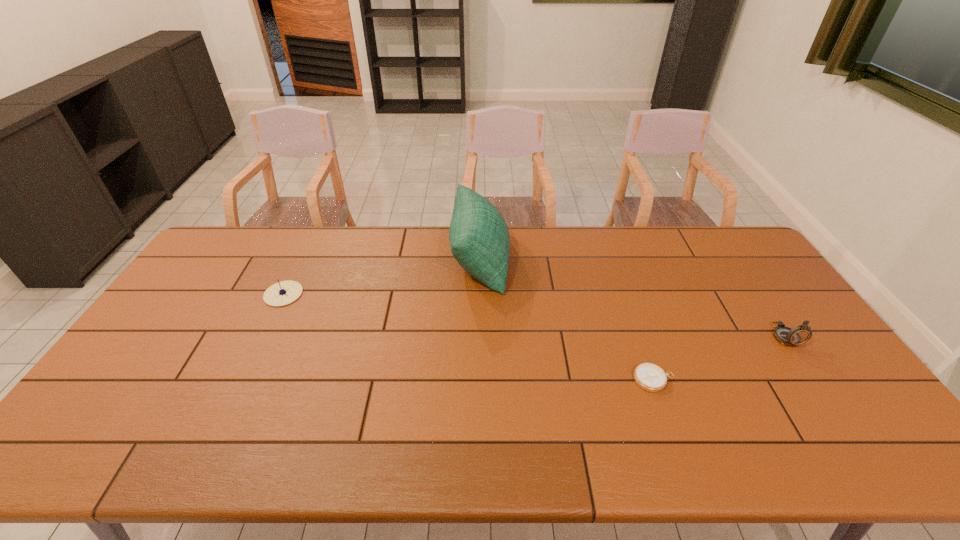
The image size is (960, 540). Find the location of `empty space between the farthest compass and the rightmost object`. empty space between the farthest compass and the rightmost object is located at coordinates (534, 315).

The height and width of the screenshot is (540, 960). I want to click on vacant region between the shortest object and the cushion, so click(567, 320).

Locate an element on the screen. The width and height of the screenshot is (960, 540). unoccupied area between the cushion and the second shortest compass is located at coordinates (382, 278).

The width and height of the screenshot is (960, 540). In order to click on free spot between the nearest object and the second nearest object in this screenshot , I will do `click(719, 357)`.

Image resolution: width=960 pixels, height=540 pixels. What are the coordinates of `vacant space in between the second object from left to right and the second compass from left to right` in the screenshot? It's located at (567, 320).

At what (x,y) coordinates should I click in order to perform the action: click on vacant space that is in between the second compass from left to right and the second tallest object. Please return your answer as a coordinate pair (x, y). This screenshot has width=960, height=540. Looking at the image, I should click on (719, 357).

Locate an element on the screen. The image size is (960, 540). vacant area that lies between the cushion and the rightmost compass is located at coordinates tap(632, 298).

The width and height of the screenshot is (960, 540). Identify the location of free space that is in between the second object from left to right and the leftmost object. (382, 278).

Locate an element on the screen. Image resolution: width=960 pixels, height=540 pixels. empty space between the tallest compass and the shortest object is located at coordinates (719, 357).

Choose which object is the nearest neighbor to the second tallest compass. Please provide its 2D coordinates. Your answer should be formatted as a tuple, i.e. [(x, y)], where the tuple contains the x and y coordinates of a point satisfying the conditions above.

[(479, 238)]